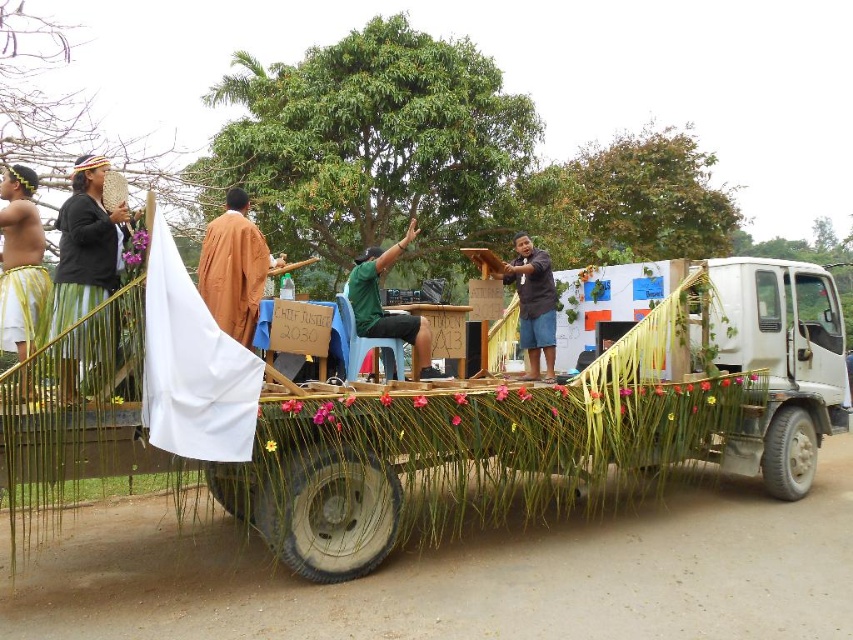
In the scene shown: You are standing on the ground next to the decorated truck and see the two people on the truck bed. The yellow grass skirt at left is worn by one of them. How far apart are the two people on the truck bed?

The two people on the truck bed are 13.98 feet apart.

You are standing on the sidewalk next to the decorated truck and want to hand a leaflet to both the person wearing the matte black woven hat at upper left and the person holding the brown fabric at center. If you can throw a leaflet 4 meters, will you be able to reach both of them?

The matte black woven hat at upper left and brown fabric at center are 4.22 meters apart. Since the distance between them is slightly more than 4 meters, you might not be able to reach both with a single throw of 4 meters. However, if you can throw to one and they can pass it to the other, that would work.

You are standing in front of the decorated truck and want to reach the point at coordinates point (x=231, y=211). Can you determine if you can safely reach it without any obstacles?

The point (x=231, y=211) is 17.57 feet away from the viewer, so you can safely reach it as there are no obstacles mentioned in the scene description.